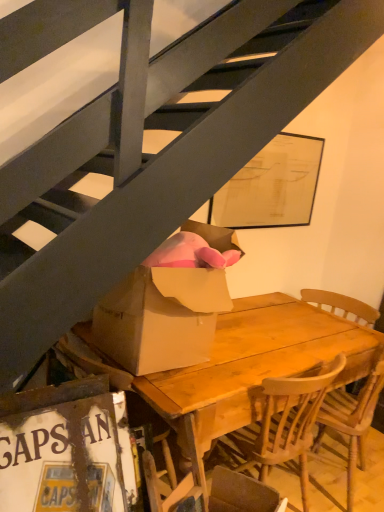
Question: Considering the positions of point tap(76, 510) and point tap(364, 315), is point tap(76, 510) closer or farther from the camera than point tap(364, 315)?

Choices:
 (A) farther
 (B) closer

Answer: (B)

Question: Is white cardboard sign at lower left wider or thinner than wooden chair at center?

Choices:
 (A) wide
 (B) thin

Answer: (B)

Question: Which of these objects is positioned closest to the wooden chair at center?

Choices:
 (A) white cardboard sign at lower left
 (B) brown cardboard box at center
 (C) wooden table at center

Answer: (C)

Question: Considering the real-world distances, which object is closest to the wooden chair at center?

Choices:
 (A) white cardboard sign at lower left
 (B) wooden table at center
 (C) brown cardboard box at center

Answer: (B)